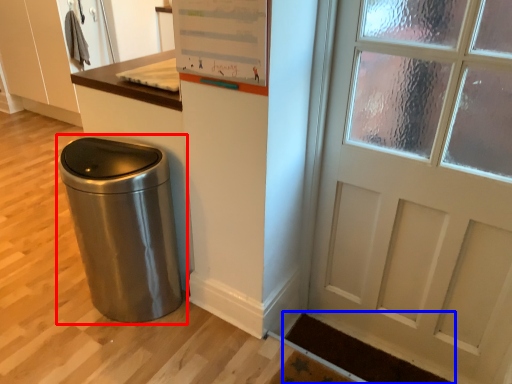
Question: Which object is further to the camera taking this photo, waste container (highlighted by a red box) or doormat (highlighted by a blue box)?

Choices:
 (A) waste container
 (B) doormat

Answer: (B)